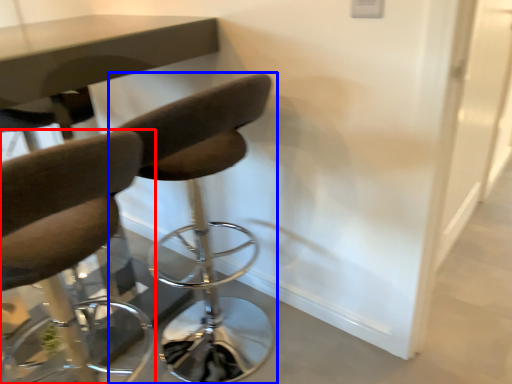
Question: Which of the following is the farthest to the observer, chair (highlighted by a red box) or chair (highlighted by a blue box)?

Choices:
 (A) chair
 (B) chair

Answer: (B)